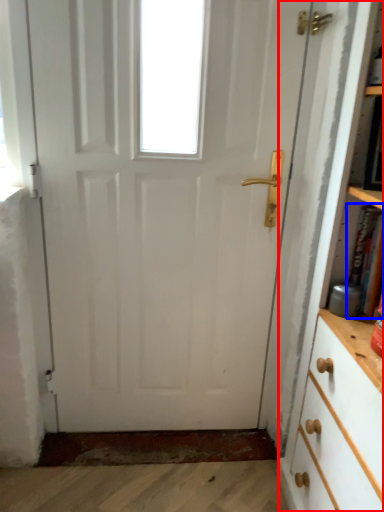
Question: Which object is further to the camera taking this photo, bookcase (highlighted by a red box) or book (highlighted by a blue box)?

Choices:
 (A) bookcase
 (B) book

Answer: (B)